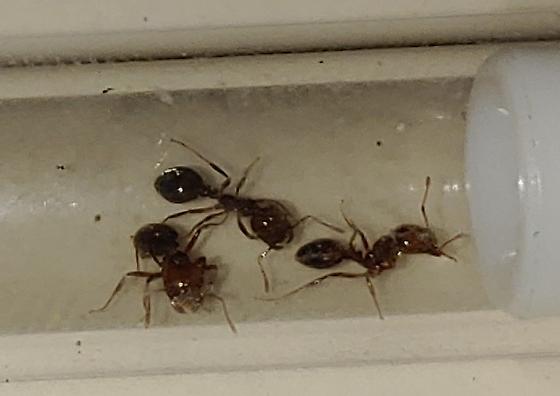
This screenshot has height=396, width=560. Find the location of `wall`. wall is located at coordinates (204, 31).